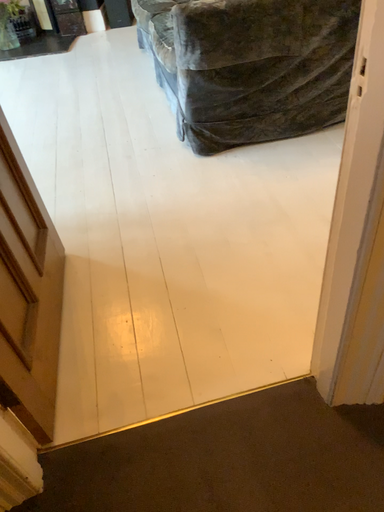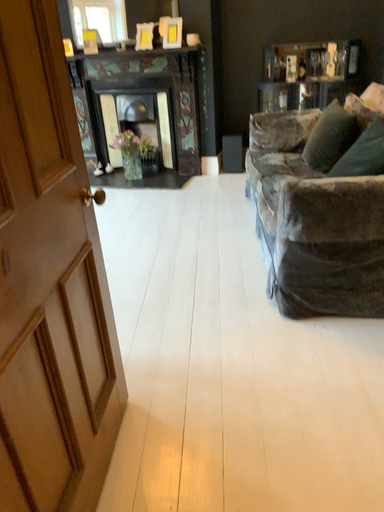
Question: How did the camera likely rotate when shooting the video?

Choices:
 (A) rotated upward
 (B) rotated downward

Answer: (A)